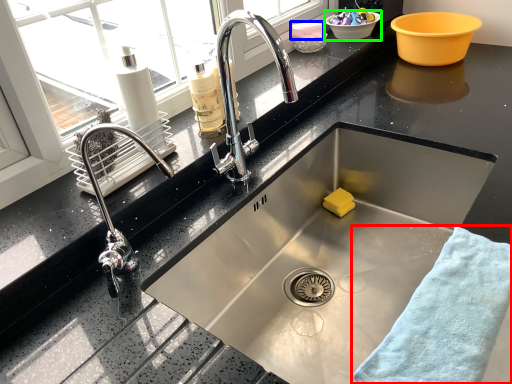
Question: Considering the real-world distances, which object is farthest from bath towel (highlighted by a red box)? basin (highlighted by a blue box) or basin (highlighted by a green box)?

Choices:
 (A) basin
 (B) basin

Answer: (B)